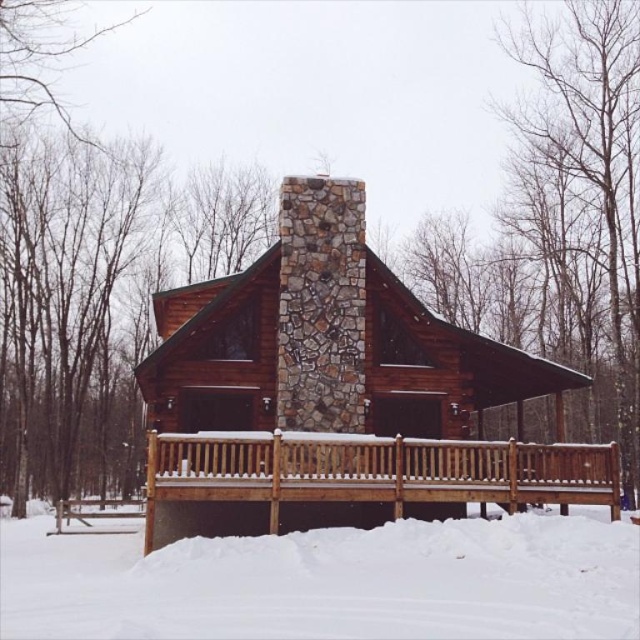
Which of these two, white fluffy snow at lower center or brown wooden deck at lower center, stands shorter?

Standing shorter between the two is white fluffy snow at lower center.

Measure the distance from white fluffy snow at lower center to brown wooden deck at lower center.

7.71 feet

Where is `white fluffy snow at lower center`? white fluffy snow at lower center is located at coordinates (330, 580).